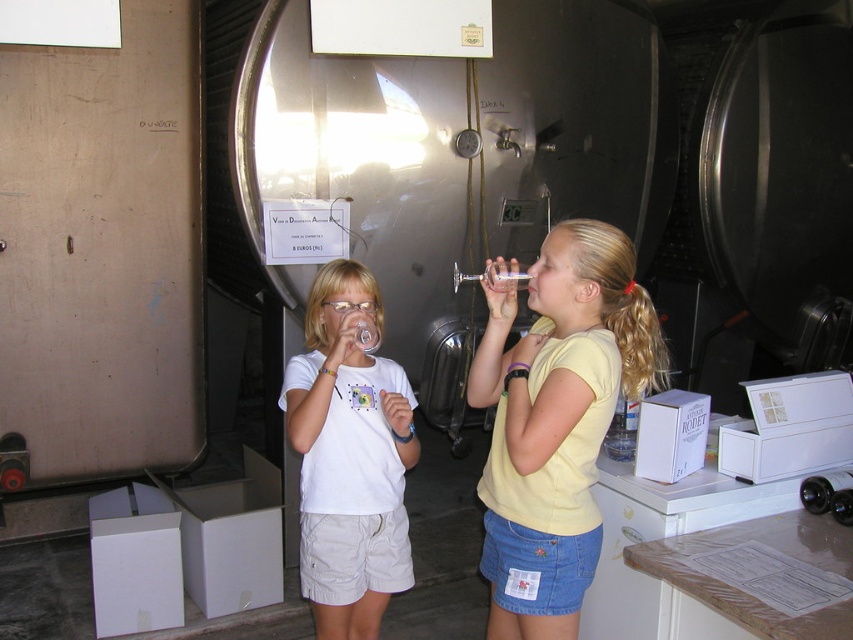
Question: Does yellow matte shirt at center appear on the right side of white matte t-shirt at center?

Choices:
 (A) no
 (B) yes

Answer: (B)

Question: Which of the following is the closest to the observer?

Choices:
 (A) white matte t-shirt at center
 (B) yellow matte shirt at center

Answer: (B)

Question: Can you confirm if yellow matte shirt at center is bigger than white matte t-shirt at center?

Choices:
 (A) no
 (B) yes

Answer: (B)

Question: Does yellow matte shirt at center have a larger size compared to white matte t-shirt at center?

Choices:
 (A) no
 (B) yes

Answer: (B)